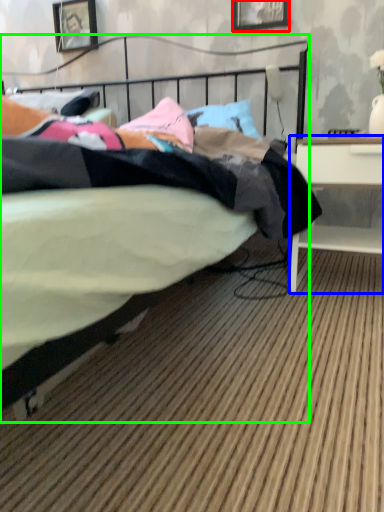
Question: Which is farther away from picture frame (highlighted by a red box)? desk (highlighted by a blue box) or bed (highlighted by a green box)?

Choices:
 (A) desk
 (B) bed

Answer: (B)